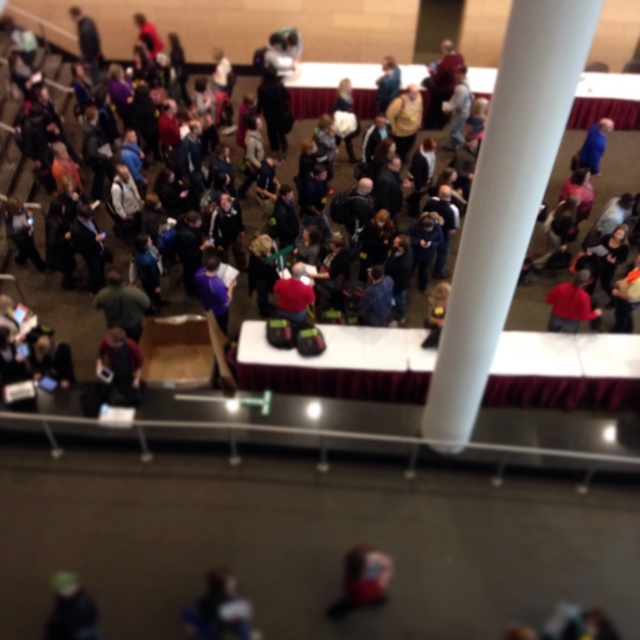
Consider the image. You are at a crowded indoor event and need to locate two people wearing a dark gray hoodie at center and a red matte shirt at center. Which one is larger in size?

The dark gray hoodie at center is bigger than the red matte shirt at center.

You are a photographer at the event and want to capture a photo that includes both the green knit hat at lower left and the red matte shirt at center. Given that your camera has a maximum focus range of 20 feet, will you be able to capture both subjects in focus?

The green knit hat at lower left is 22.04 feet from the red matte shirt at center. Since your camera can only focus up to 20 feet, you won cannot capture both subjects in focus simultaneously.

You are at an event and want to find the red matte shirt at center. Which direction should you look relative to the green knit hat at lower left?

The red matte shirt at center is to the right of the green knit hat at lower left.